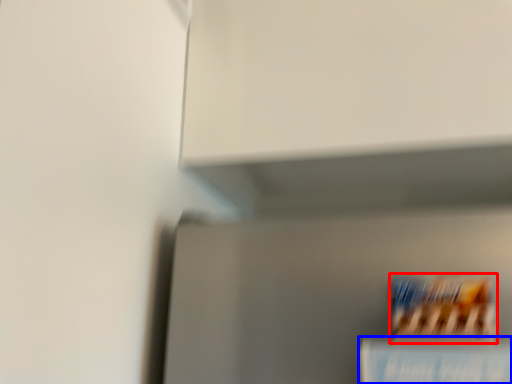
Question: Which point is further to the camera, cereal (highlighted by a red box) or book (highlighted by a blue box)?

Choices:
 (A) cereal
 (B) book

Answer: (A)